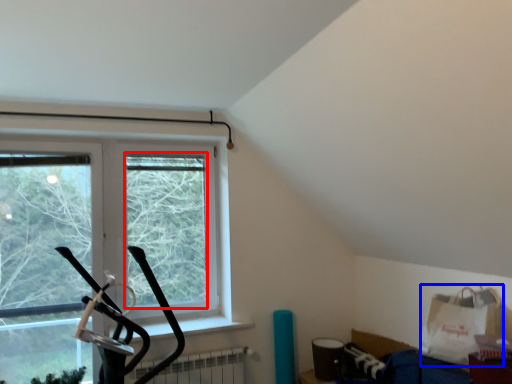
Question: Which object appears farthest to the camera in this image, window screen (highlighted by a red box) or grocery bag (highlighted by a blue box)?

Choices:
 (A) window screen
 (B) grocery bag

Answer: (A)